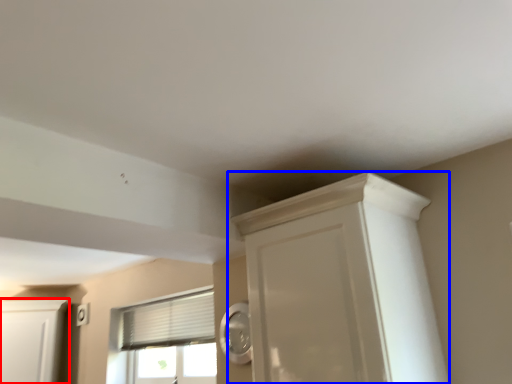
Question: Which object is further to the camera taking this photo, cabinetry (highlighted by a red box) or cupboard (highlighted by a blue box)?

Choices:
 (A) cabinetry
 (B) cupboard

Answer: (A)